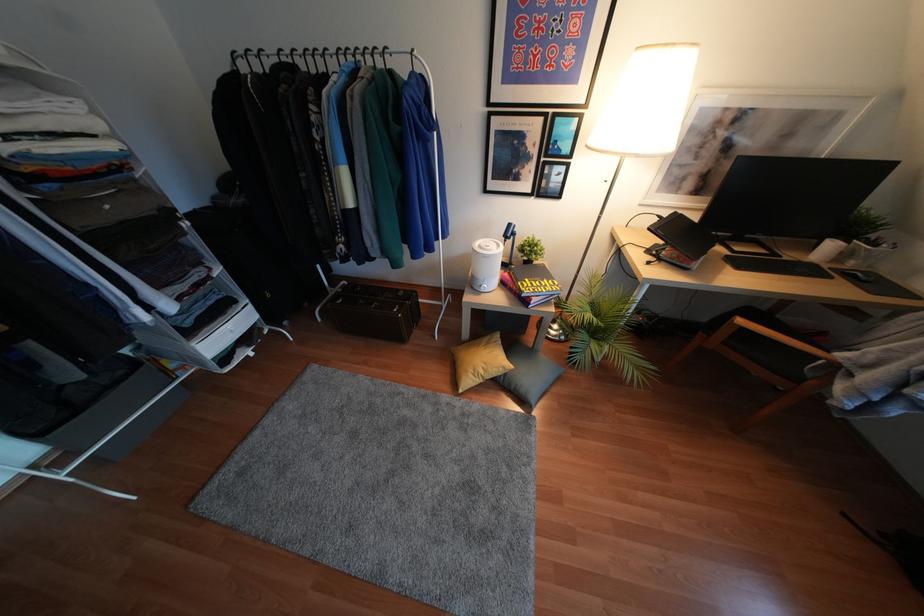
Which object does [856,275] point to?

It corresponds to the black computer mouse in the image.